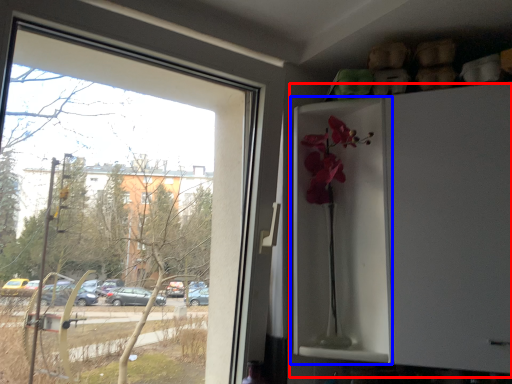
Question: Which object appears farthest to the camera in this image, fridge (highlighted by a red box) or screen door (highlighted by a blue box)?

Choices:
 (A) fridge
 (B) screen door

Answer: (B)